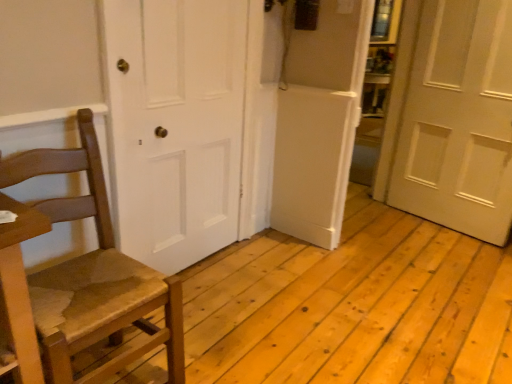
I want to click on free space to the right of white matte door at center, which ranks as the 2th door in right-to-left order, so click(x=263, y=275).